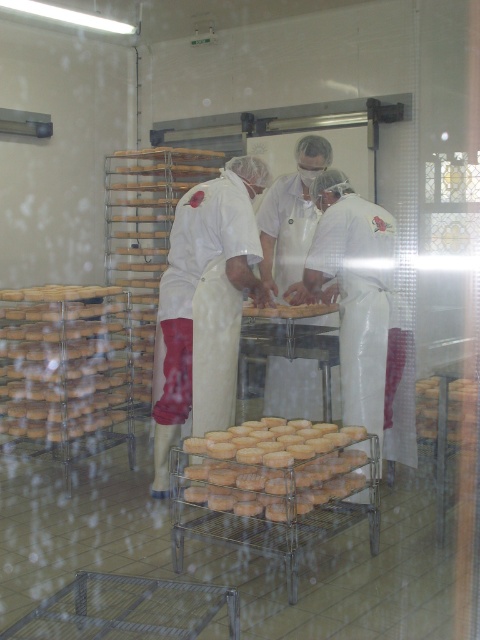
You are a quality inspector in the cheese facility. You need to check the golden brown crumbly pastry at center and the white smooth uniform at center. Which object is located to the left of the other?

The white smooth uniform at center is to the left of the golden brown crumbly pastry at center.